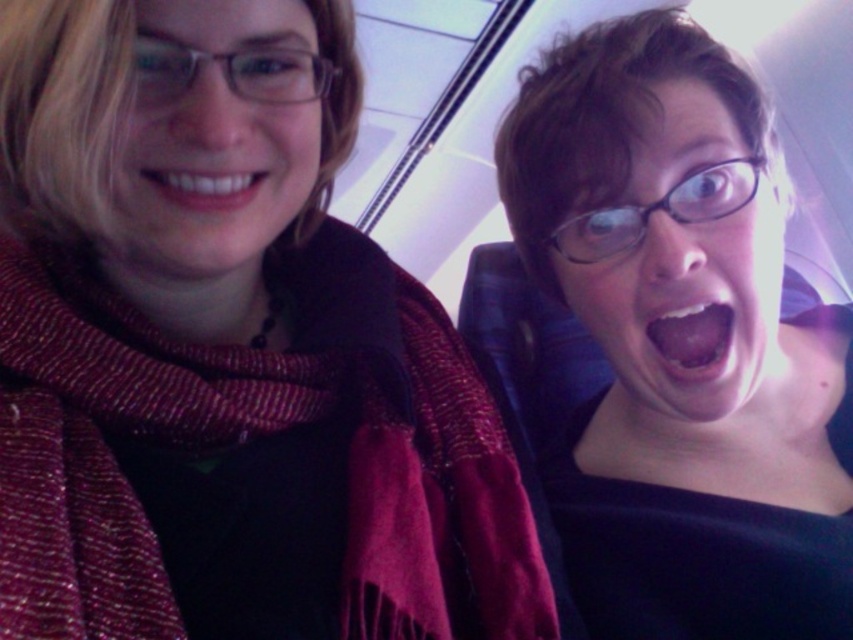
You are a flight attendant checking passengers for safety. You notice two scarves on the person on the left. Which scarf is closer to you, the woven wool scarf at left or the matte black scarf at left?

The woven wool scarf at left is closer to you because it is in front of the matte black scarf at left.